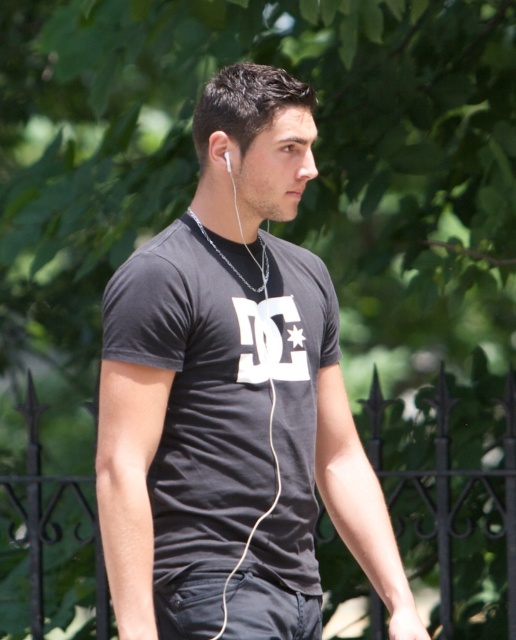
Question: Which point is closer to the camera?

Choices:
 (A) (173, 524)
 (B) (228, 163)

Answer: (A)

Question: Can you confirm if matte black t-shirt at center is smaller than white earbud at left?

Choices:
 (A) no
 (B) yes

Answer: (A)

Question: Does matte black t-shirt at center appear on the left side of white earbud at left?

Choices:
 (A) yes
 (B) no

Answer: (B)

Question: Among these objects, which one is nearest to the camera?

Choices:
 (A) matte black t-shirt at center
 (B) white earbud at left

Answer: (A)

Question: Does matte black t-shirt at center appear under white earbud at left?

Choices:
 (A) no
 (B) yes

Answer: (B)